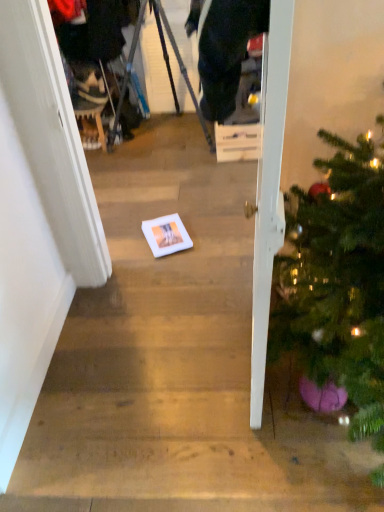
At what (x,y) coordinates should I click in order to perform the action: click on vacant space situated on the left part of white cardboard box at center. Please return your answer as a coordinate pair (x, y). The image size is (384, 512). Looking at the image, I should click on pos(183,149).